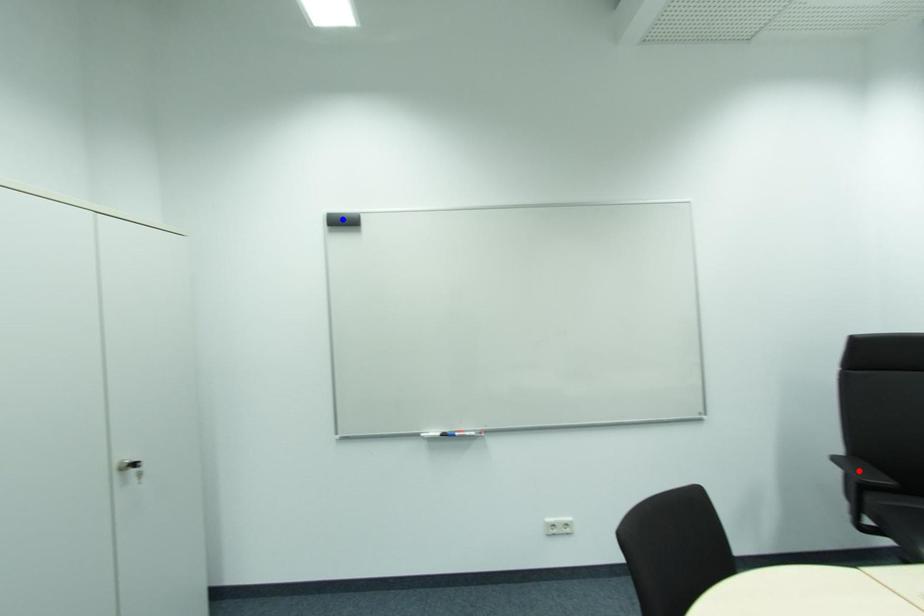
Question: Two points are marked on the image. Which point is closer to the camera?

Choices:
 (A) Blue point is closer.
 (B) Red point is closer.

Answer: (B)